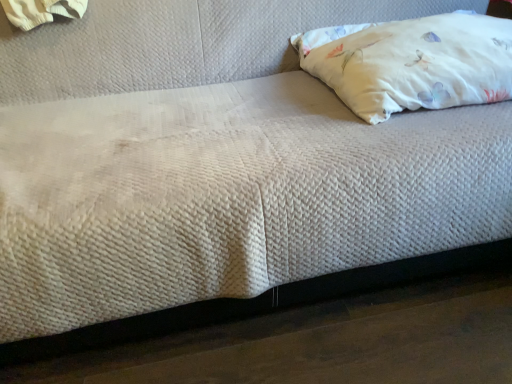
What do you see at coordinates (412, 62) in the screenshot? The width and height of the screenshot is (512, 384). I see `white cotton pillow at upper right` at bounding box center [412, 62].

This screenshot has width=512, height=384. I want to click on white cotton pillow at upper right, so point(412,62).

You are a GUI agent. You are given a task and a screenshot of the screen. Output one action in this format:
    pyautogui.click(x=<x>, y=<y>)
    Task: Click on the white cotton pillow at upper right
    
    Given the screenshot: What is the action you would take?
    pyautogui.click(x=412, y=62)